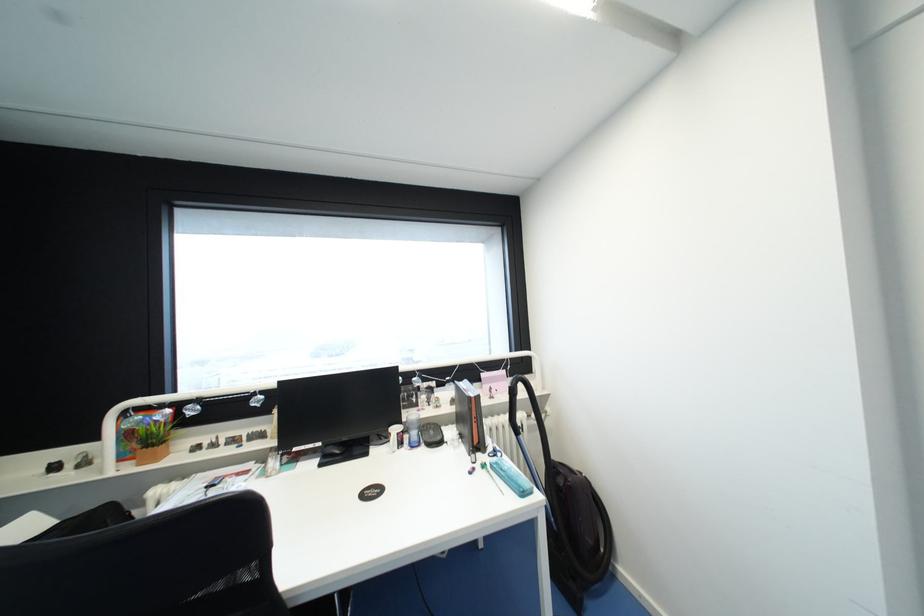
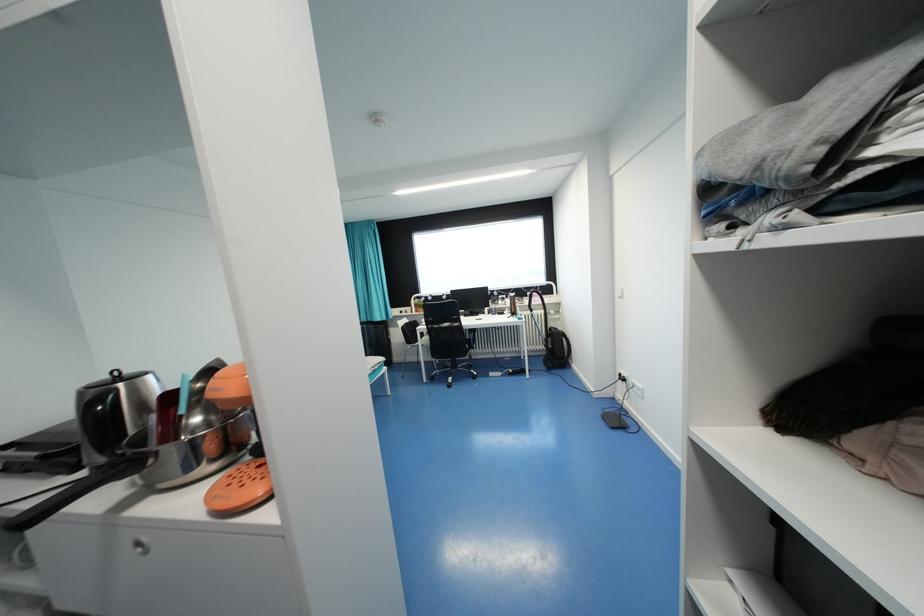
The point at (515, 394) is marked in the first image. Where is the corresponding point in the second image?

(533, 298)